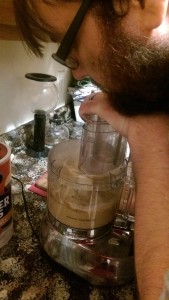
This screenshot has width=169, height=300. Identify the location of white wall behind countertop. (13, 105), (8, 73), (45, 66).